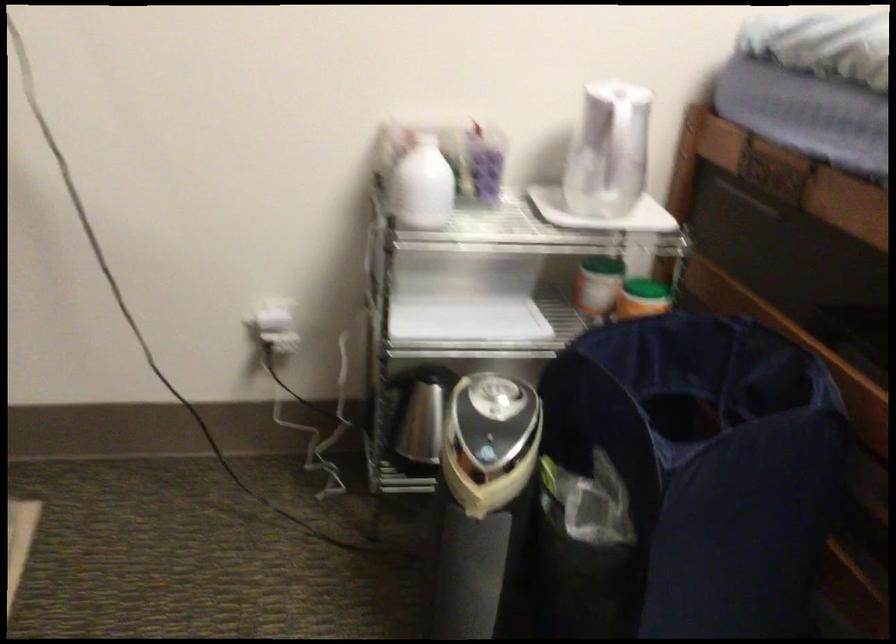
At what (x,y) coordinates should I click in order to perform the action: click on orange jar lid. Please return your answer as a coordinate pair (x, y). This screenshot has width=896, height=644. Looking at the image, I should click on (642, 298).